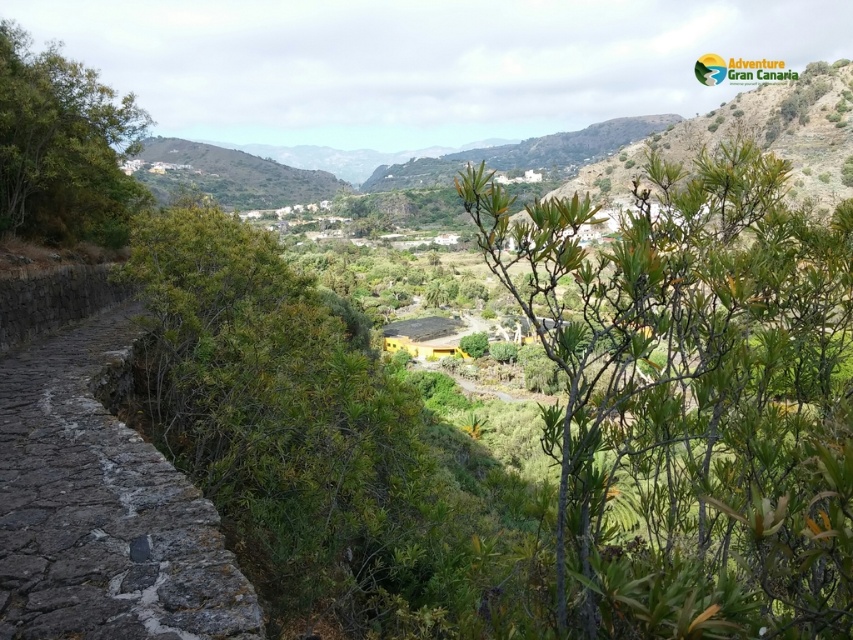
Looking at this image, you are a hiker planning to take a photo of both the green leafy shrub at center and the green leafy shrub at upper left. Which shrub should you focus on first to ensure both are in the frame?

You should focus on the green leafy shrub at center first because it is bigger and will require more space in the frame, ensuring the smaller green leafy shrub at upper left can also be included.

You are a hiker standing at the start of the trail. You see the dark gray cobblestone path at center and the green leafy shrub at upper left. Which object is positioned to the right of the other?

The dark gray cobblestone path at center is to the right of green leafy shrub at upper left.